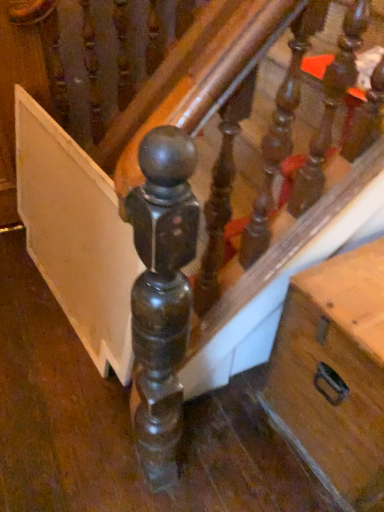
The width and height of the screenshot is (384, 512). Identify the location of wooden drawer at lower right. (335, 374).

What do you see at coordinates (335, 374) in the screenshot? I see `wooden drawer at lower right` at bounding box center [335, 374].

This screenshot has width=384, height=512. What are the coordinates of `wooden drawer at lower right` in the screenshot? It's located at (335, 374).